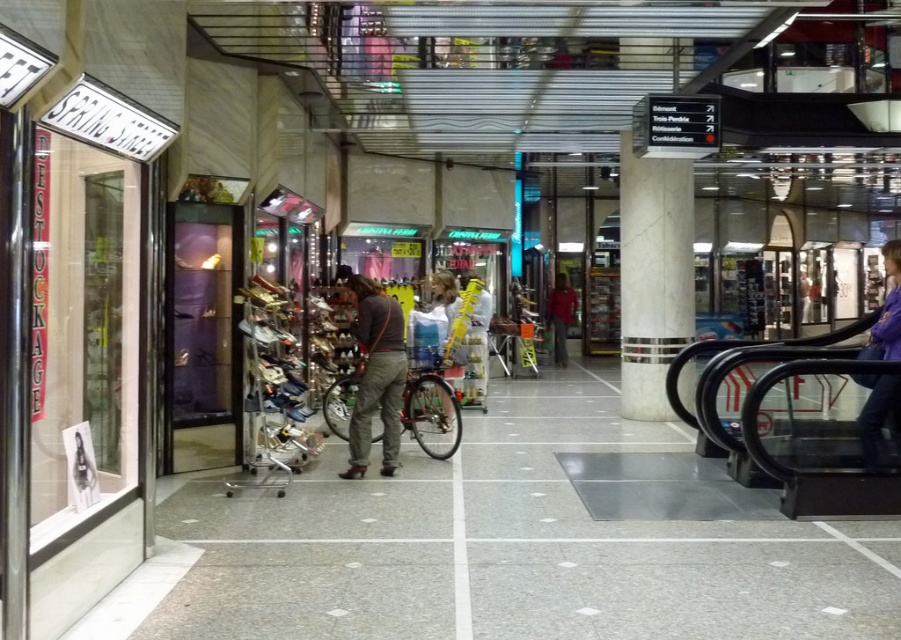
You are standing at the entrance of the shopping mall and want to reach the white marble pillar at center. According to the mall layout, in which direction should you walk from your current position?

The white marble pillar at center is located at point (653, 275), so you should walk towards the center of the mall to reach it.

You are a delivery person carrying a large box that is 1 meter wide. You need to navigate through the shopping mall and pass between the white marble pillar at center and the purple fabric jacket at lower right. Can your box fit through the space between them?

The white marble pillar at center occupies less space than the purple fabric jacket at lower right, so the space between them may be sufficient for the box to pass through. However, since the exact dimensions are not provided, it is recommended to measure the gap before proceeding.

Consider the image. You are standing in the shopping mall and want to move from point (624, 225) to point (333, 428). Which direction should you move in relation to the storefront with the glass facade displaying clothing?

You should move away from the storefront with the glass facade displaying clothing because point (624, 225) is closer to the storefront than point (333, 428).